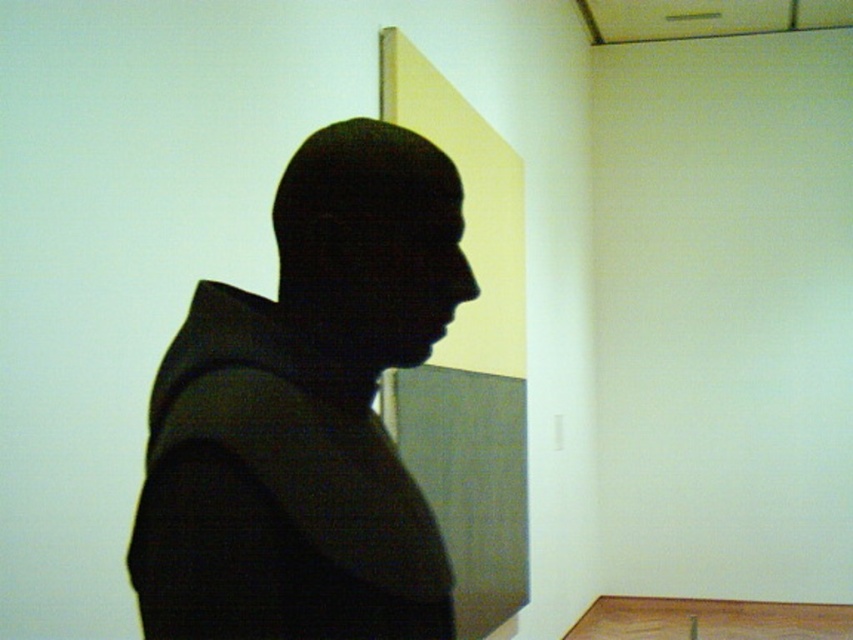
You are an art curator examining the image. You notice two objects labeled as the black matte bust at center and the black matte head at center. Which one has a greater height?

The black matte bust at center is taller than the black matte head at center.

You are an interior designer planning to place a new sculpture in this space. You have two options from the catalog. The first is the black matte bust at center, and the second is the black matte head at center. According to the description, which one would you choose if you want the sculpture to occupy more horizontal space?

The black matte bust at center is wider than the black matte head at center, so it would occupy more horizontal space.